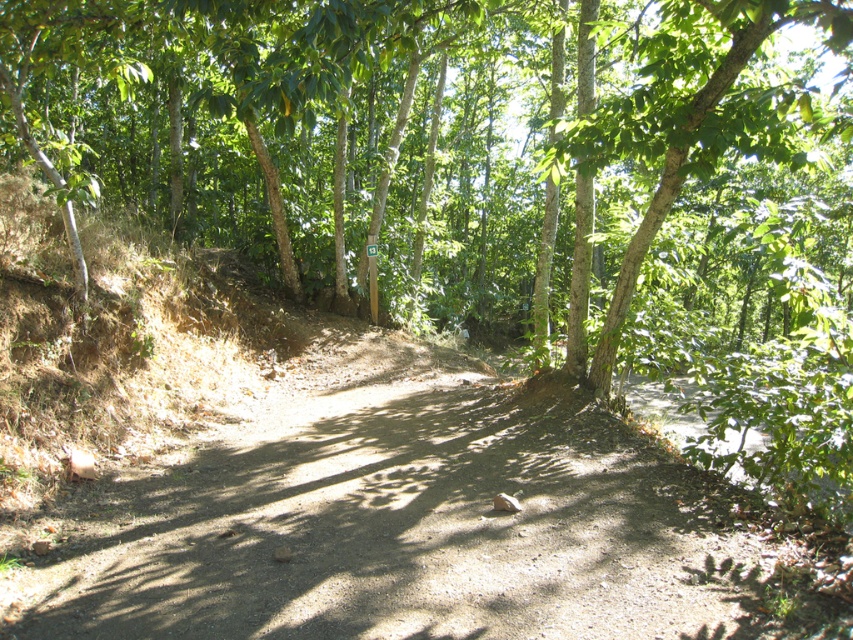
Question: Which point is closer to the camera?

Choices:
 (A) green leafy tree at center
 (B) brown dirt track at center

Answer: (B)

Question: Which point appears farthest from the camera in this image?

Choices:
 (A) (352, 531)
 (B) (345, 45)

Answer: (A)

Question: Does green leafy tree at center appear over brown dirt track at center?

Choices:
 (A) yes
 (B) no

Answer: (A)

Question: Is green leafy tree at center thinner than brown dirt track at center?

Choices:
 (A) yes
 (B) no

Answer: (B)

Question: In this image, where is green leafy tree at center located relative to brown dirt track at center?

Choices:
 (A) right
 (B) left

Answer: (A)